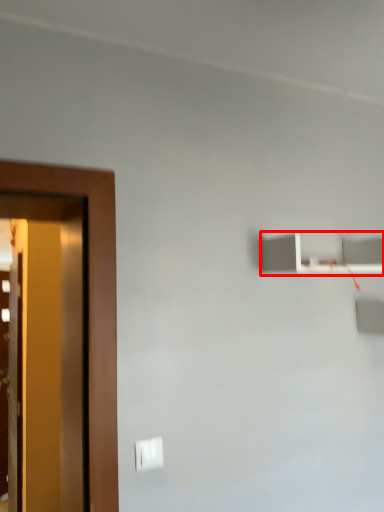
Question: From the image's perspective, considering the relative positions of shelf (annotated by the red box) and light switch in the image provided, where is shelf (annotated by the red box) located with respect to the staircase?

Choices:
 (A) above
 (B) below

Answer: (A)